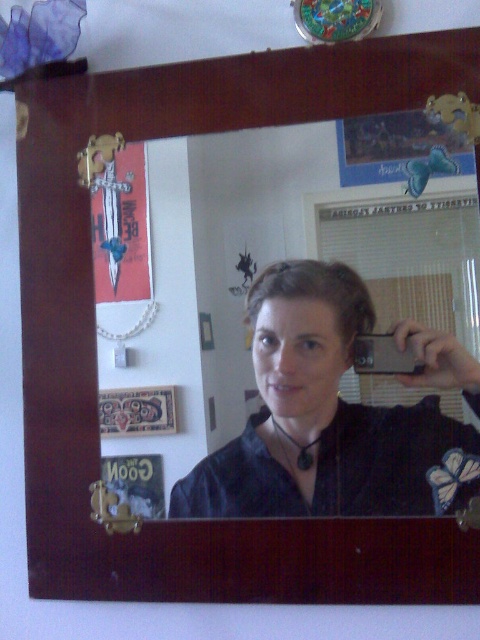
You are trying to determine the exact position of the matte black shirt at center in the image. According to the coordinates provided, what are the x and y values of its location?

The 2D location of the matte black shirt at center is at point with x value 0.656 and y value 0.679.

You are standing in front of the mirror and notice the matte black shirt at center and the wooden picture frame at lower left. Which object is closer to you based on their positions in the reflection?

The matte black shirt at center is closer to you because it is in front of the wooden picture frame at lower left in the reflection.